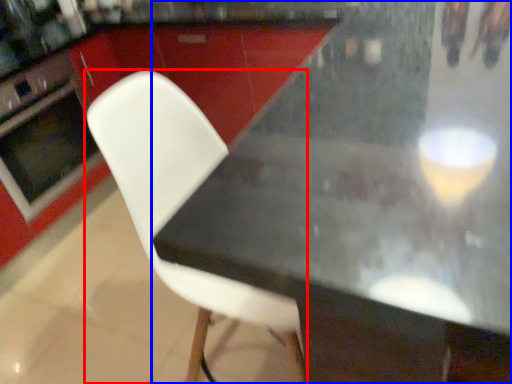
Question: Which point is further to the camera, chair (highlighted by a red box) or table (highlighted by a blue box)?

Choices:
 (A) chair
 (B) table

Answer: (A)